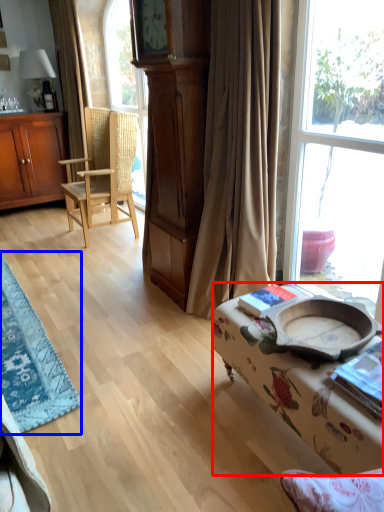
Question: Which of the following is the closest to the observer, studio couch (highlighted by a red box) or table (highlighted by a blue box)?

Choices:
 (A) studio couch
 (B) table

Answer: (A)